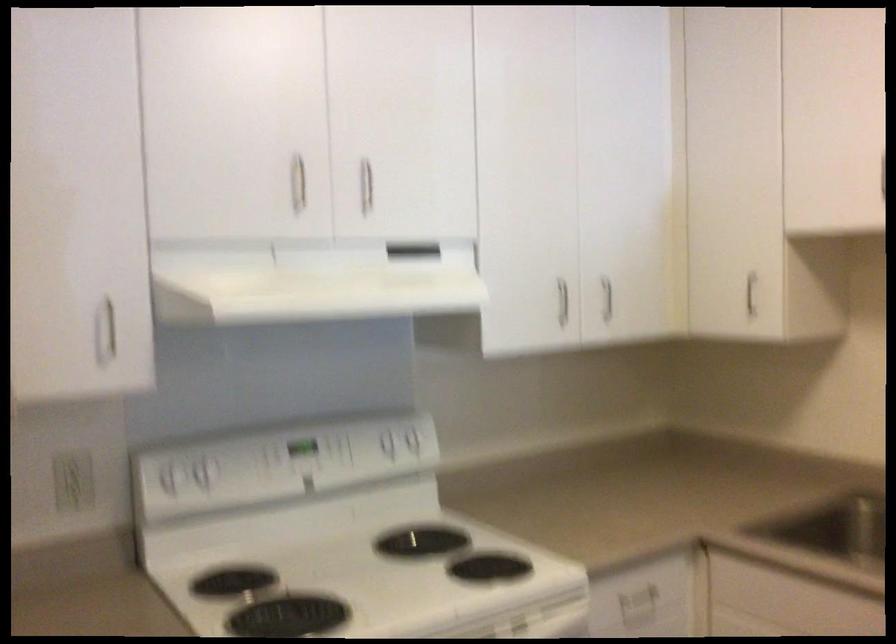
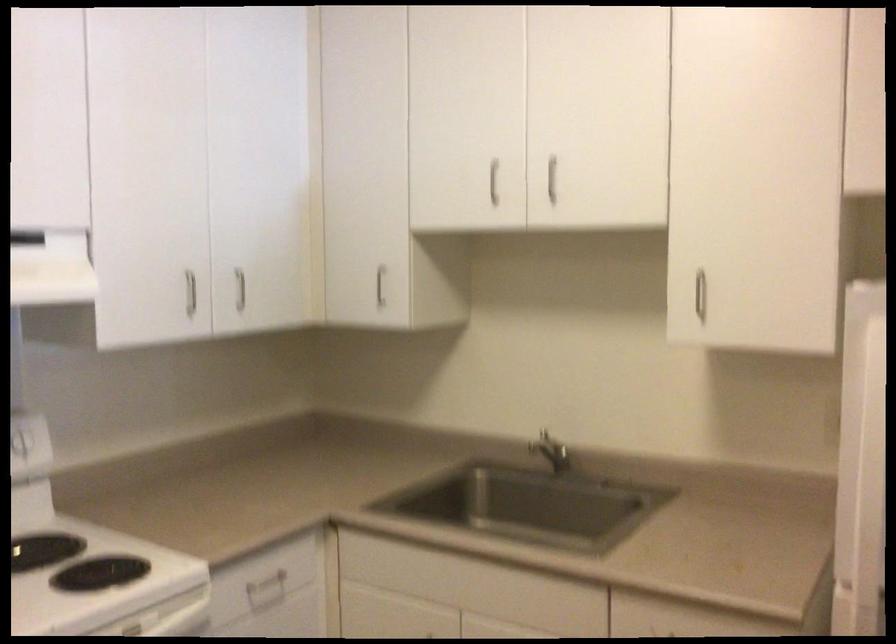
Question: How did the camera likely rotate?

Choices:
 (A) Left
 (B) Right
 (C) Up
 (D) Down

Answer: (B)